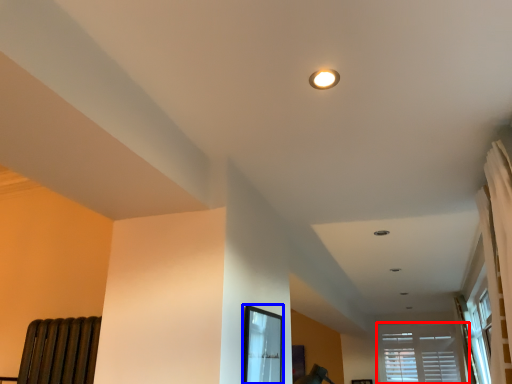
Question: Which object appears closest to the camera in this image, window (highlighted by a red box) or bay window (highlighted by a blue box)?

Choices:
 (A) window
 (B) bay window

Answer: (B)